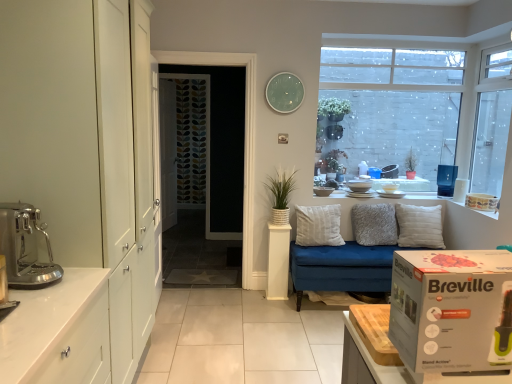
Question: From a real-world perspective, is white cardboard box at right positioned over metallic stainless steel coffee machine at left, which is the fourth appliance in back-to-front order, based on gravity?

Choices:
 (A) yes
 (B) no

Answer: (A)

Question: Is metallic stainless steel coffee machine at left, the first appliance in the front-to-back sequence, surrounded by white cardboard box at right?

Choices:
 (A) yes
 (B) no

Answer: (B)

Question: Can you confirm if white cardboard box at right is positioned to the left of metallic stainless steel coffee machine at left, which is counted as the 1th appliance, starting from the left?

Choices:
 (A) no
 (B) yes

Answer: (A)

Question: Does white cardboard box at right lie in front of metallic stainless steel coffee machine at left, the fourth appliance from the top?

Choices:
 (A) yes
 (B) no

Answer: (A)

Question: Is white cardboard box at right smaller than metallic stainless steel coffee machine at left, the fourth appliance when ordered from right to left?

Choices:
 (A) yes
 (B) no

Answer: (B)

Question: Is metallic stainless steel coffee machine at left, acting as the first appliance starting from the bottom, at the back of white cardboard box at right?

Choices:
 (A) yes
 (B) no

Answer: (B)

Question: Is grey fluffy pillow at center, the second pillow viewed from the left, positioned with its back to white ceramic bowl at upper right, the third appliance in the left-to-right sequence?

Choices:
 (A) yes
 (B) no

Answer: (B)

Question: Is grey fluffy pillow at center, acting as the 2th pillow starting from the right, next to white ceramic bowl at upper right, which ranks as the 2th appliance in right-to-left order, and touching it?

Choices:
 (A) no
 (B) yes

Answer: (A)

Question: From a real-world perspective, is grey fluffy pillow at center, the second pillow viewed from the left, below white ceramic bowl at upper right, the third appliance in the left-to-right sequence?

Choices:
 (A) no
 (B) yes

Answer: (B)

Question: Does grey fluffy pillow at center, acting as the 2th pillow starting from the right, appear on the left side of white ceramic bowl at upper right, the fourth appliance when ordered from bottom to top?

Choices:
 (A) yes
 (B) no

Answer: (B)

Question: Can you confirm if grey fluffy pillow at center, the second pillow viewed from the left, is thinner than white ceramic bowl at upper right, which ranks as the 2th appliance in right-to-left order?

Choices:
 (A) yes
 (B) no

Answer: (A)

Question: Could you tell me if grey fluffy pillow at center, the second pillow viewed from the left, is turned towards white ceramic bowl at upper right, which ranks as the 2th appliance in right-to-left order?

Choices:
 (A) no
 (B) yes

Answer: (A)

Question: Is grey fluffy pillow at center, acting as the 2th pillow starting from the right, at the left side of white textured pot at center?

Choices:
 (A) no
 (B) yes

Answer: (A)